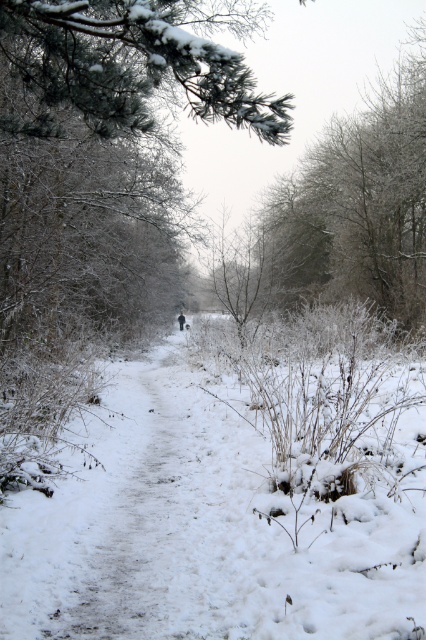
Question: Which point is farther to the camera?

Choices:
 (A) white fluffy snow at center
 (B) green textured pine branch at upper left

Answer: (B)

Question: Does white fluffy snow at center appear on the right side of green textured pine branch at upper left?

Choices:
 (A) no
 (B) yes

Answer: (B)

Question: Is white fluffy snow at center positioned at the back of green textured pine branch at upper left?

Choices:
 (A) yes
 (B) no

Answer: (B)

Question: Does white fluffy snow at center lie in front of green textured pine branch at upper left?

Choices:
 (A) yes
 (B) no

Answer: (A)